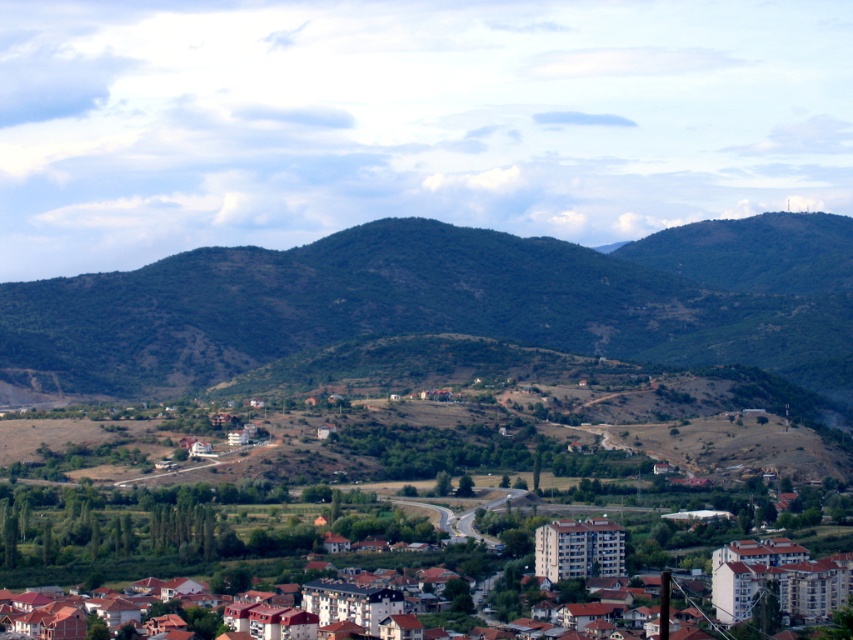
You are standing at the edge of the green leafy hillside at center and looking towards the brown brick houses at center. Are the houses visible from your current position?

The green leafy hillside at center is in front of the brown brick houses at center, so the houses are partially or fully blocked by the hillside and may not be entirely visible from your position.